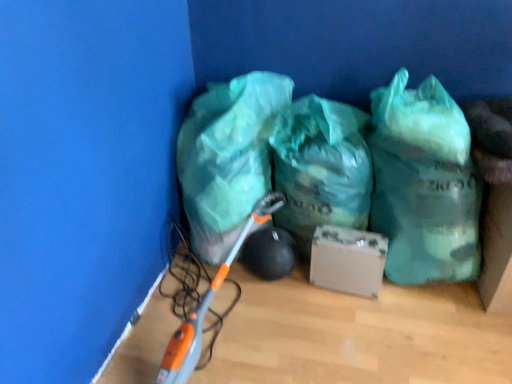
The image size is (512, 384). What are the coordinates of `vacant area that lies to the right of matte cardboard box at center` in the screenshot? It's located at (405, 301).